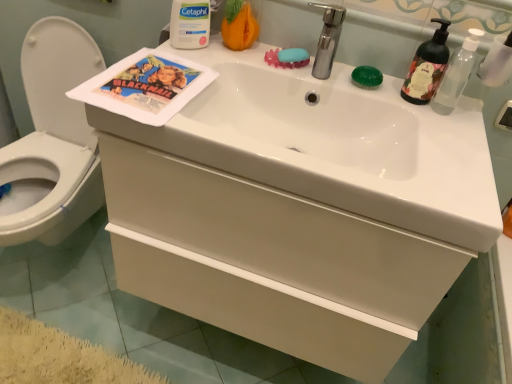
Locate an element on the screen. This screenshot has height=384, width=512. free space in front of green matte soap dispenser at upper right is located at coordinates (441, 133).